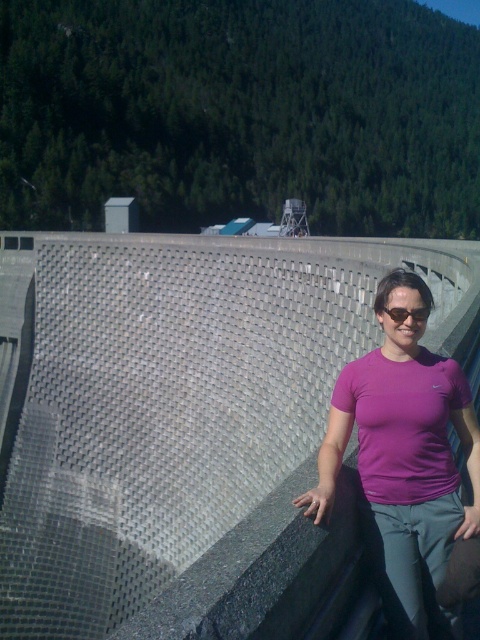
Measure the distance between gray textured dam at center and camera.

gray textured dam at center and camera are 20.19 feet apart.

Describe the element at coordinates (186, 422) in the screenshot. I see `gray textured dam at center` at that location.

Does point (26, 339) come in front of point (445, 390)?

No.

Find the location of `gray textured dam at center`. gray textured dam at center is located at coordinates (186, 422).

Is gray textured dam at center taller than black plastic sunglasses at center?

Yes.

Is gray textured dam at center positioned behind black plastic sunglasses at center?

That is False.

This screenshot has height=640, width=480. I want to click on gray textured dam at center, so click(186, 422).

Find the location of a particular element. The height and width of the screenshot is (640, 480). gray textured dam at center is located at coordinates (186, 422).

Which is behind, point (379, 552) or point (403, 320)?

Point (403, 320)

Who is more distant from viewer, (x=374, y=477) or (x=389, y=308)?

The point (x=389, y=308) is behind.

The width and height of the screenshot is (480, 640). What are the coordinates of `purple matte t-shirt at center` in the screenshot? It's located at (404, 458).